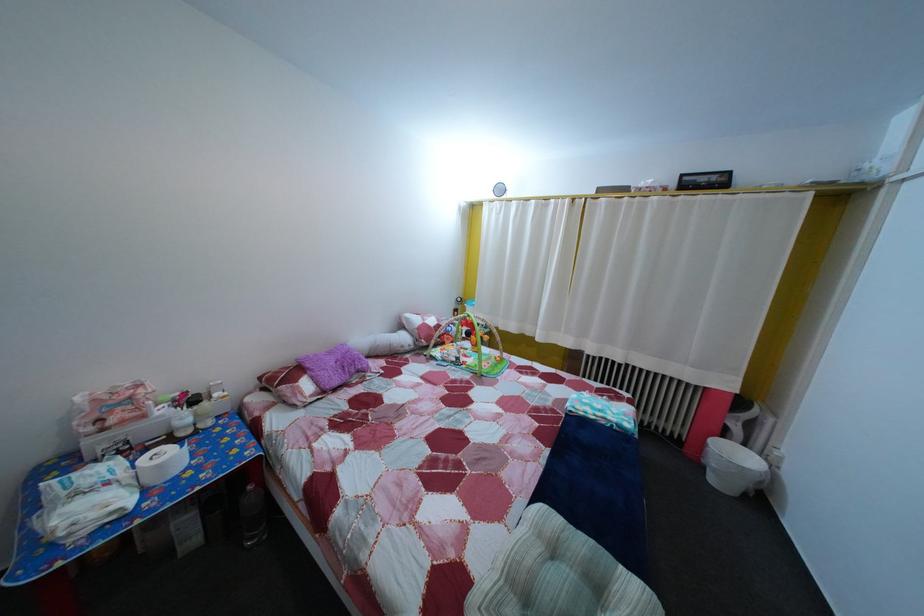
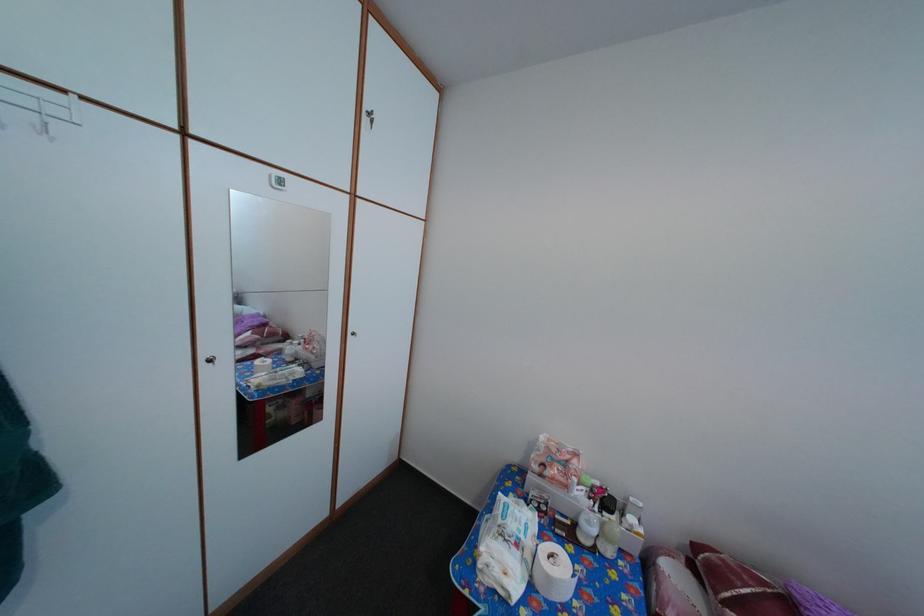
The point at (187, 431) is marked in the first image. Where is the corresponding point in the second image?

(592, 531)